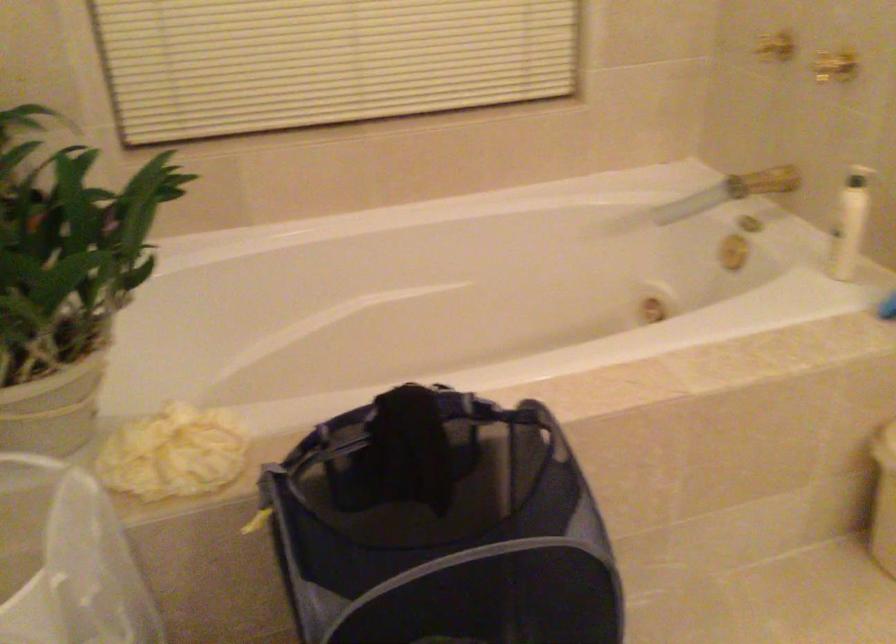
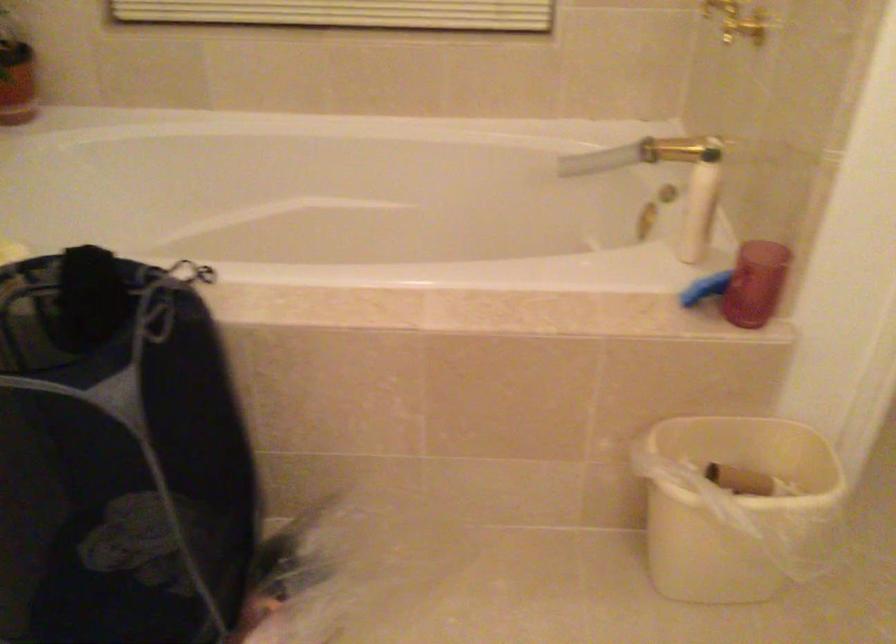
Question: Based on the continuous images, in which direction is the camera rotating? Reply with the corresponding letter.

Choices:
 (A) Left
 (B) Right
 (C) Up
 (D) Down

Answer: (A)